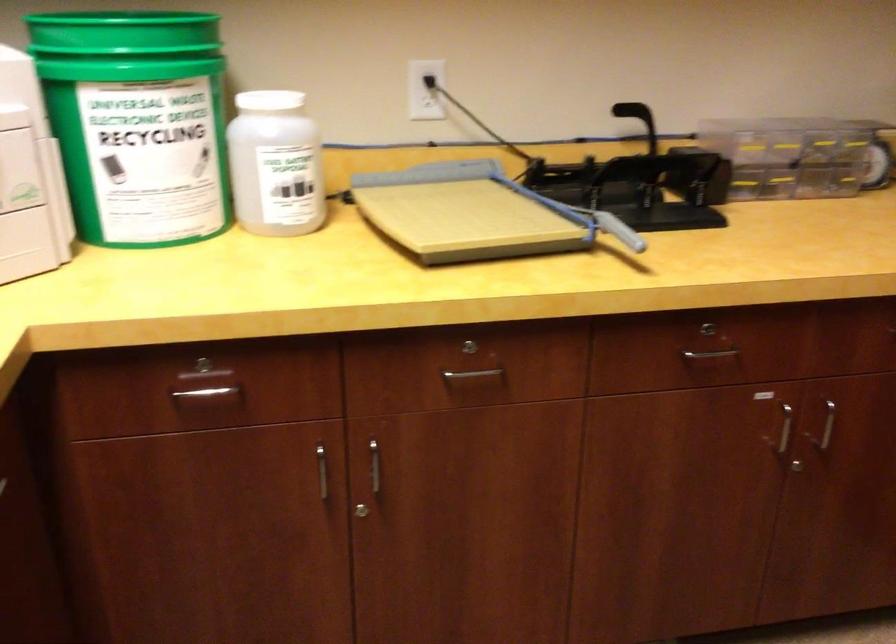
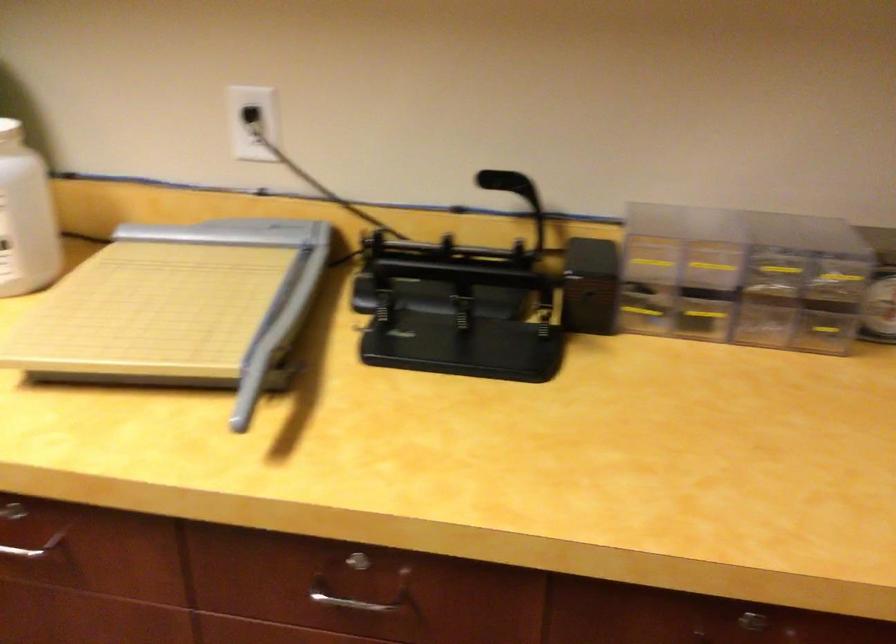
The point at (x=546, y=202) is marked in the first image. Where is the corresponding point in the second image?

(277, 301)